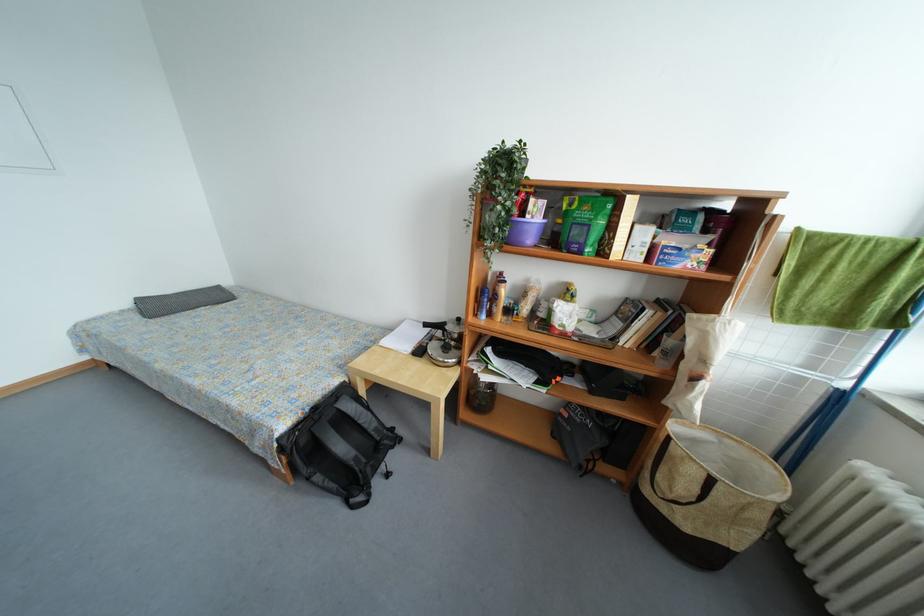
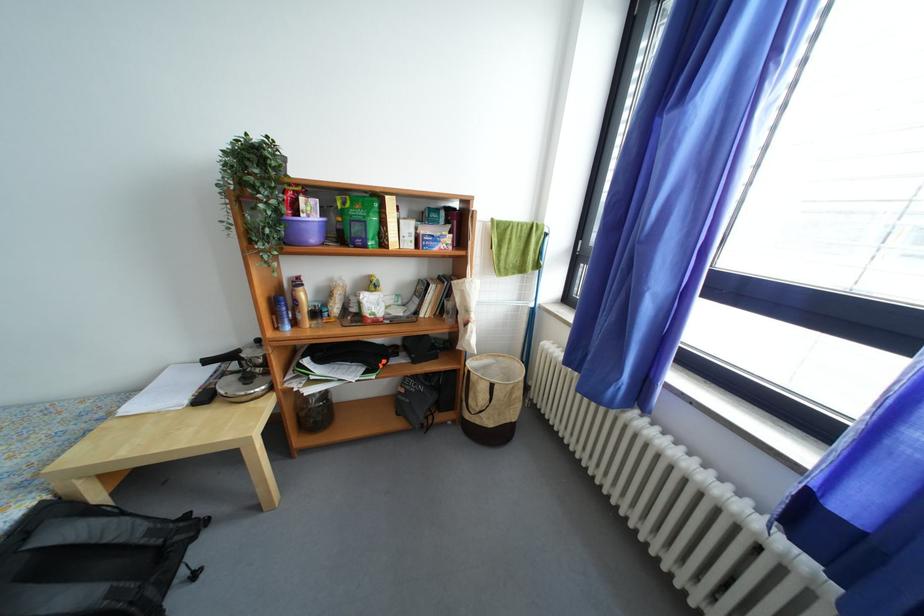
Locate, in the second image, the point that corresponds to point 566,225 in the first image.

(346, 224)